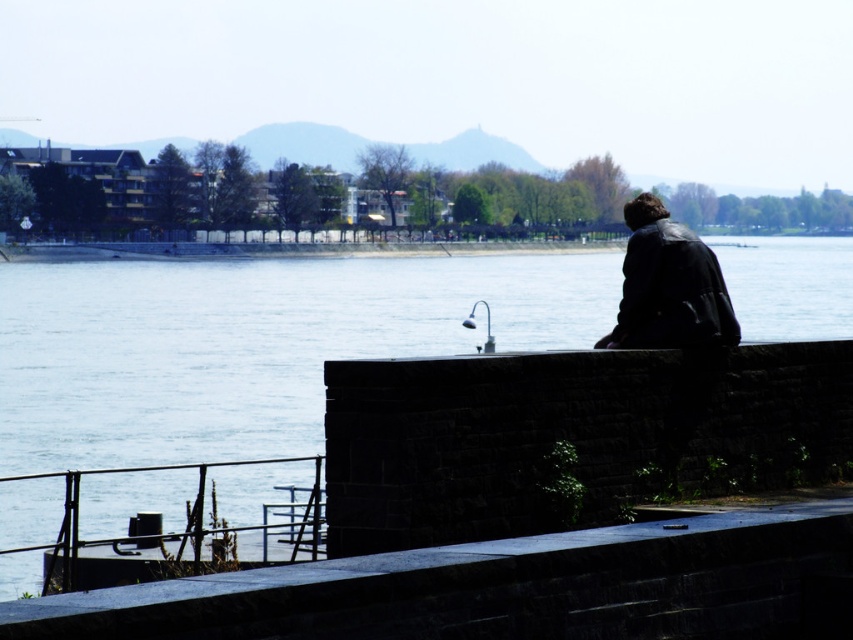
Who is higher up, smooth stone ledge at lower center or leather jacket at right?

leather jacket at right

Does smooth stone ledge at lower center appear on the left side of leather jacket at right?

Yes, smooth stone ledge at lower center is to the left of leather jacket at right.

Find the location of a particular element. The image size is (853, 640). smooth stone ledge at lower center is located at coordinates (506, 588).

Can you confirm if blue water at center is smaller than leather jacket at right?

Incorrect, blue water at center is not smaller in size than leather jacket at right.

Image resolution: width=853 pixels, height=640 pixels. Identify the location of blue water at center. (250, 344).

Between point (297, 348) and point (566, 564), which one is positioned in front?

Point (566, 564) is more forward.

Is blue water at center wider than smooth stone ledge at lower center?

Yes.

This screenshot has height=640, width=853. What are the coordinates of `blue water at center` in the screenshot? It's located at (250, 344).